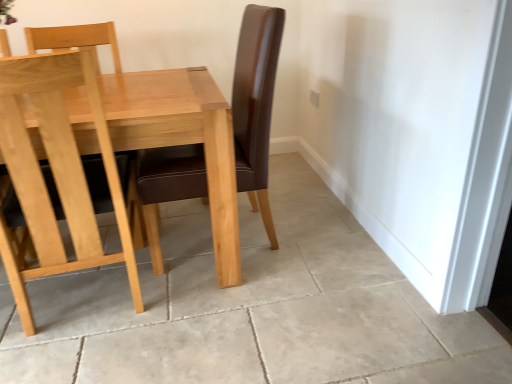
Question: Is light gray tile floor at center spatially inside natural wood table at center, or outside of it?

Choices:
 (A) inside
 (B) outside

Answer: (B)

Question: Is light gray tile floor at center in front of or behind natural wood table at center in the image?

Choices:
 (A) front
 (B) behind

Answer: (A)

Question: Estimate the real-world distances between objects in this image. Which object is farther from the light brown wood chair at left?

Choices:
 (A) natural wood table at center
 (B) light gray tile floor at center

Answer: (B)

Question: Considering the real-world distances, which object is farthest from the natural wood table at center?

Choices:
 (A) light gray tile floor at center
 (B) light brown wood chair at left

Answer: (A)